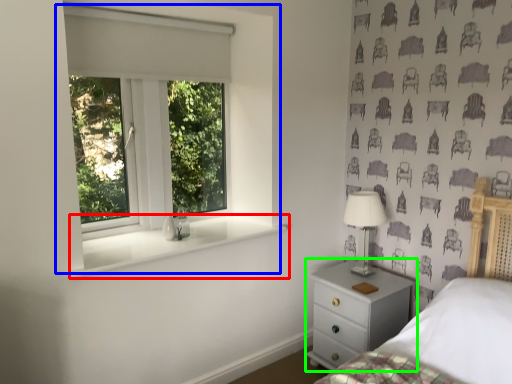
Question: Which is nearer to the window sill (highlighted by a red box)? window (highlighted by a blue box) or chest of drawers (highlighted by a green box).

Choices:
 (A) window
 (B) chest of drawers

Answer: (A)